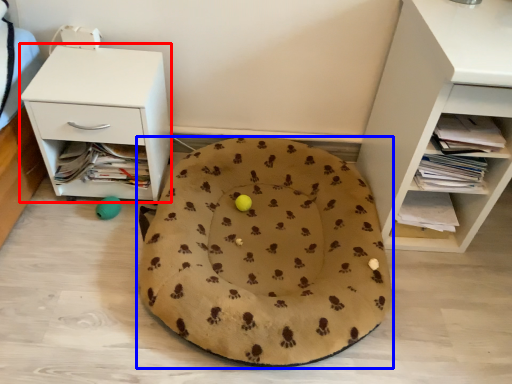
Question: Which object is closer to the camera taking this photo, nightstand (highlighted by a red box) or dog bed (highlighted by a blue box)?

Choices:
 (A) nightstand
 (B) dog bed

Answer: (B)